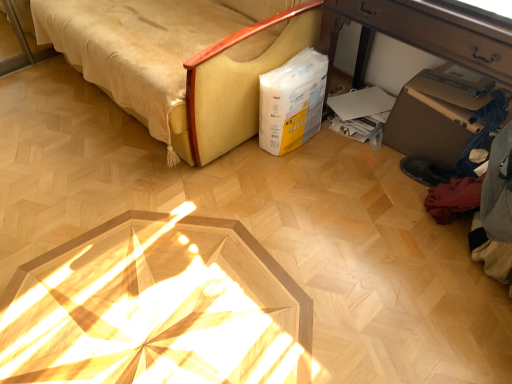
Question: Is brown cardboard box at lower right to the right of white paper bag at center-right from the viewer's perspective?

Choices:
 (A) no
 (B) yes

Answer: (B)

Question: From a real-world perspective, does brown cardboard box at lower right sit lower than white paper bag at center-right?

Choices:
 (A) yes
 (B) no

Answer: (B)

Question: Is brown cardboard box at lower right turned away from white paper bag at center-right?

Choices:
 (A) no
 (B) yes

Answer: (A)

Question: Does brown cardboard box at lower right lie in front of white paper bag at center-right?

Choices:
 (A) no
 (B) yes

Answer: (B)

Question: Does brown cardboard box at lower right come behind white paper bag at center-right?

Choices:
 (A) yes
 (B) no

Answer: (B)

Question: From the image's perspective, is wooden desk at lower right above or below brown cardboard box at lower right?

Choices:
 (A) above
 (B) below

Answer: (A)

Question: Is wooden desk at lower right bigger or smaller than brown cardboard box at lower right?

Choices:
 (A) big
 (B) small

Answer: (A)

Question: Is wooden desk at lower right spatially inside brown cardboard box at lower right, or outside of it?

Choices:
 (A) inside
 (B) outside

Answer: (B)

Question: Does point (348, 3) appear closer or farther from the camera than point (408, 148)?

Choices:
 (A) closer
 (B) farther

Answer: (A)

Question: Considering the positions of brown cardboard box at lower right and beige fabric sofa at upper left in the image, is brown cardboard box at lower right taller or shorter than beige fabric sofa at upper left?

Choices:
 (A) short
 (B) tall

Answer: (A)

Question: From the image's perspective, is brown cardboard box at lower right positioned above or below beige fabric sofa at upper left?

Choices:
 (A) above
 (B) below

Answer: (B)

Question: In terms of size, does brown cardboard box at lower right appear bigger or smaller than beige fabric sofa at upper left?

Choices:
 (A) small
 (B) big

Answer: (A)

Question: Is point (399, 102) positioned closer to the camera than point (156, 54)?

Choices:
 (A) closer
 (B) farther

Answer: (B)

Question: From the image's perspective, is white paper bag at center-right located above or below brown cardboard box at lower right?

Choices:
 (A) above
 (B) below

Answer: (A)

Question: Considering the positions of white paper bag at center-right and brown cardboard box at lower right in the image, is white paper bag at center-right wider or thinner than brown cardboard box at lower right?

Choices:
 (A) thin
 (B) wide

Answer: (A)